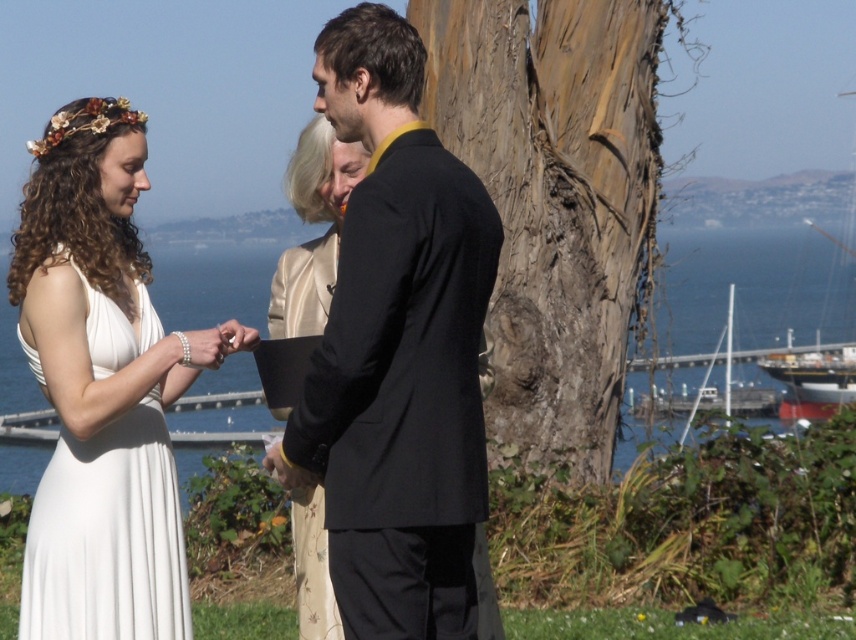
Question: Is blue water at center above white satin dress at left?

Choices:
 (A) yes
 (B) no

Answer: (A)

Question: Which of the following is the farthest from the observer?

Choices:
 (A) grayish-brown bark at center
 (B) silky beige dress at center
 (C) black matte suit at center

Answer: (A)

Question: Which of the following is the closest to the observer?

Choices:
 (A) black matte suit at center
 (B) white satin dress at center
 (C) grayish-brown bark at center
 (D) blue water at center

Answer: (A)

Question: Is white satin dress at center bigger than blue water at center?

Choices:
 (A) yes
 (B) no

Answer: (B)

Question: Does blue water at center have a larger size compared to silky beige dress at center?

Choices:
 (A) yes
 (B) no

Answer: (A)

Question: Which of the following is the closest to the observer?

Choices:
 (A) black matte suit at center
 (B) grayish-brown bark at center
 (C) silky beige dress at center

Answer: (A)